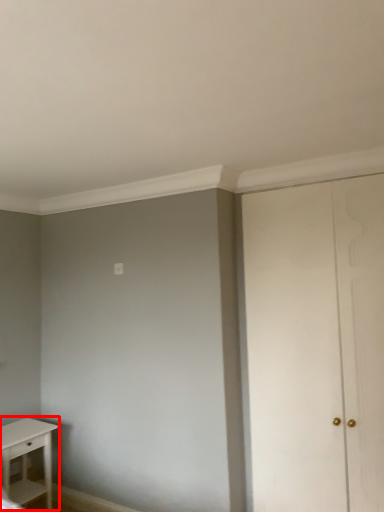
Question: From the image's perspective, where is table (annotated by the red box) located relative to door?

Choices:
 (A) below
 (B) above

Answer: (A)